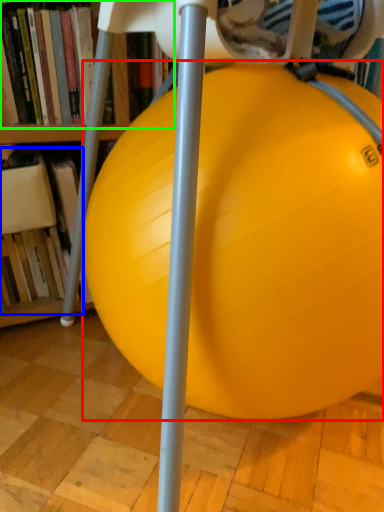
Question: Estimate the real-world distances between objects in this image. Which object is farther from ball (highlighted by a red box), book (highlighted by a blue box) or book (highlighted by a green box)?

Choices:
 (A) book
 (B) book

Answer: (A)